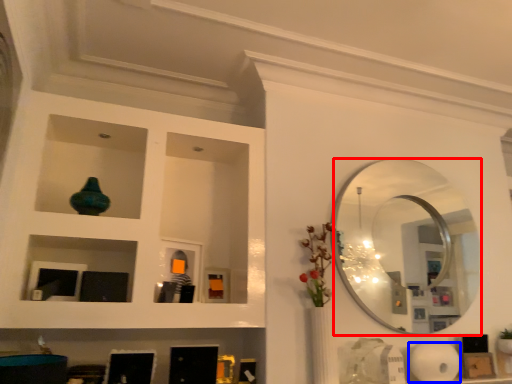
Question: Which object appears farthest to the camera in this image, mirror (highlighted by a red box) or paper towel (highlighted by a blue box)?

Choices:
 (A) mirror
 (B) paper towel

Answer: (A)